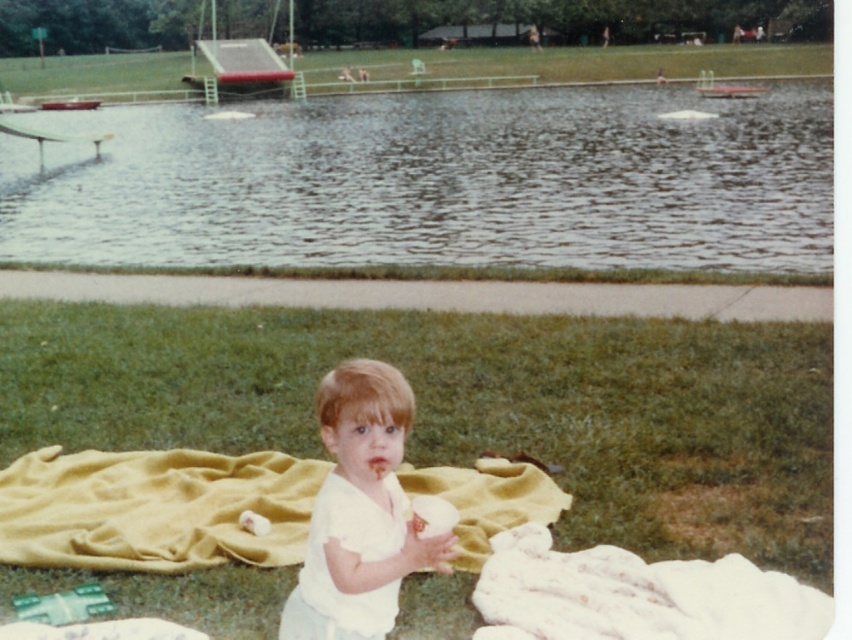
How much distance is there between white matte toddler at center and green grass at upper center?

The distance of white matte toddler at center from green grass at upper center is 85.64 meters.

Which of these two, white matte toddler at center or green grass at upper center, stands shorter?

white matte toddler at center is shorter.

Does point (361, 637) lie behind point (799, 72)?

No, (361, 637) is closer to viewer.

This screenshot has height=640, width=852. In order to click on white matte toddler at center in this screenshot , I will do `click(360, 512)`.

Is yellow fabric blanket at center above white matte toddler at center?

No.

Does yellow fabric blanket at center lie behind white matte toddler at center?

Yes, yellow fabric blanket at center is further from the viewer.

Which is behind, point (106, 564) or point (308, 579)?

The point (106, 564) is behind.

The width and height of the screenshot is (852, 640). In order to click on yellow fabric blanket at center in this screenshot , I will do (x=153, y=508).

Can you confirm if green grass at center is positioned below green grass at upper center?

Correct, green grass at center is located below green grass at upper center.

Does point (815, 552) come in front of point (118, 65)?

Yes.

The image size is (852, 640). Find the location of `green grass at center`. green grass at center is located at coordinates (471, 406).